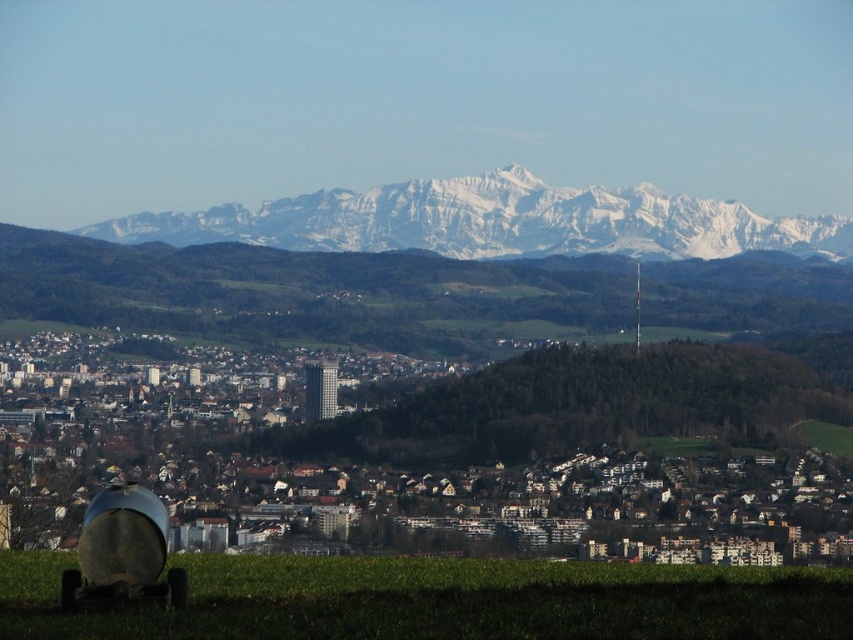
Question: Can you confirm if green grass at lower center is smaller than white snow-covered mountain range at upper center?

Choices:
 (A) yes
 (B) no

Answer: (A)

Question: Which of the following is the closest to the observer?

Choices:
 (A) green grass at lower center
 (B) white snow-covered mountain range at upper center

Answer: (B)

Question: Can you confirm if green grass at lower center is positioned below white snow-covered mountain range at upper center?

Choices:
 (A) yes
 (B) no

Answer: (A)

Question: Is green grass at lower center to the left of white snow-covered mountain range at upper center from the viewer's perspective?

Choices:
 (A) yes
 (B) no

Answer: (A)

Question: Which point is farther to the camera?

Choices:
 (A) green grass at lower center
 (B) white snow-covered mountain range at upper center

Answer: (A)